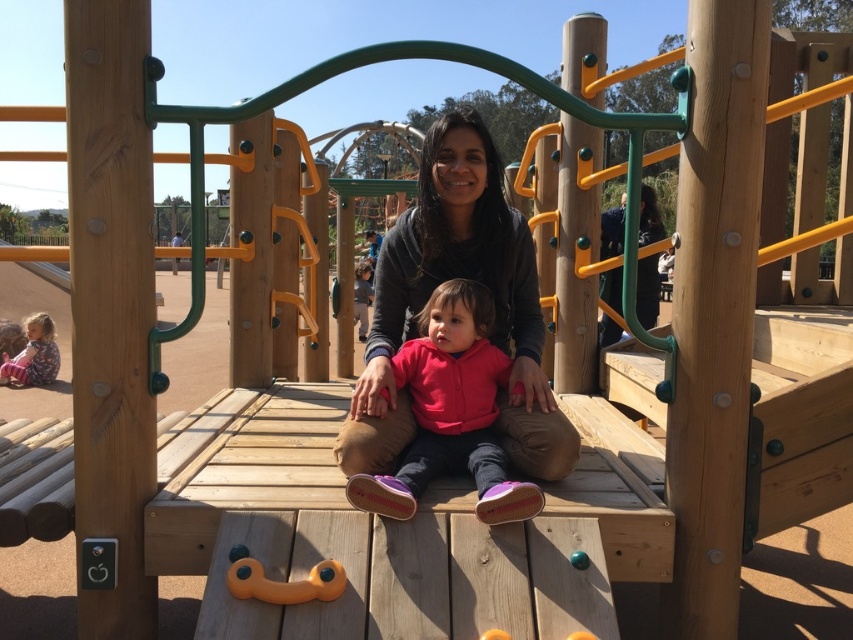
You are a GUI agent. You are given a task and a screenshot of the screen. Output one action in this format:
    pyautogui.click(x=<x>, y=<y>)
    Task: Click on the matte black hoodie at center
    
    Given the screenshot: What is the action you would take?
    pyautogui.click(x=444, y=280)

Measure the distance between matte black hoodie at center and camera.

matte black hoodie at center and camera are 7.16 feet apart from each other.

Does point (421, 212) lie behind point (45, 371)?

No.

Find the location of a particular element. This screenshot has height=640, width=853. matte black hoodie at center is located at coordinates (444, 280).

Does pink fleece jacket at center have a larger size compared to matte pink jacket at lower left?

No, pink fleece jacket at center is not bigger than matte pink jacket at lower left.

The image size is (853, 640). I want to click on pink fleece jacket at center, so click(450, 412).

Is matte black hoodie at center below pink fleece jacket at center?

No.

Does matte black hoodie at center appear on the left side of pink fleece jacket at center?

Correct, you'll find matte black hoodie at center to the left of pink fleece jacket at center.

Image resolution: width=853 pixels, height=640 pixels. Find the location of `matte black hoodie at center`. matte black hoodie at center is located at coordinates (444, 280).